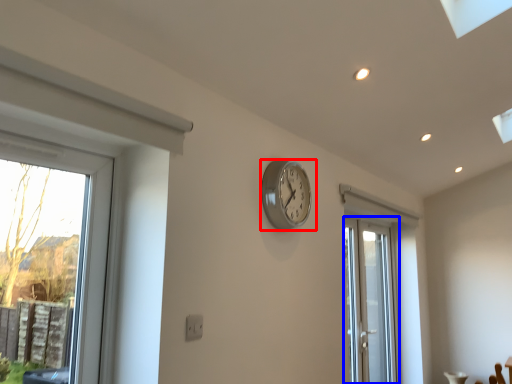
Question: Which of the following is the farthest to the observer, wall clock (highlighted by a red box) or door (highlighted by a blue box)?

Choices:
 (A) wall clock
 (B) door

Answer: (B)